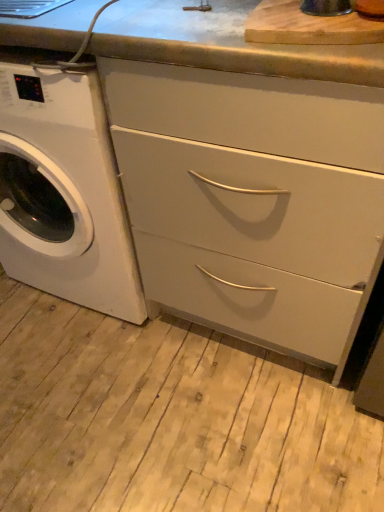
Question: Based on their sizes in the image, would you say matte white drawers at center is bigger or smaller than wooden cutting board at upper center?

Choices:
 (A) small
 (B) big

Answer: (B)

Question: Is matte white drawers at center inside or outside of wooden cutting board at upper center?

Choices:
 (A) outside
 (B) inside

Answer: (A)

Question: Estimate the real-world distances between objects in this image. Which object is closer to the white glossy washing machine at left?

Choices:
 (A) wooden cutting board at upper center
 (B) matte white drawers at center

Answer: (B)

Question: Considering the real-world distances, which object is closest to the matte white drawers at center?

Choices:
 (A) wooden cutting board at upper center
 (B) white glossy washing machine at left

Answer: (B)